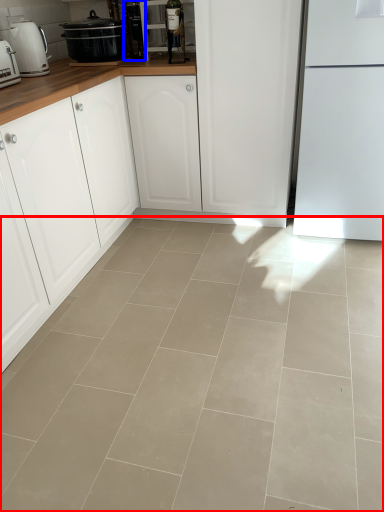
Question: Among these objects, which one is farthest to the camera, concrete (highlighted by a red box) or appliance (highlighted by a blue box)?

Choices:
 (A) concrete
 (B) appliance

Answer: (B)